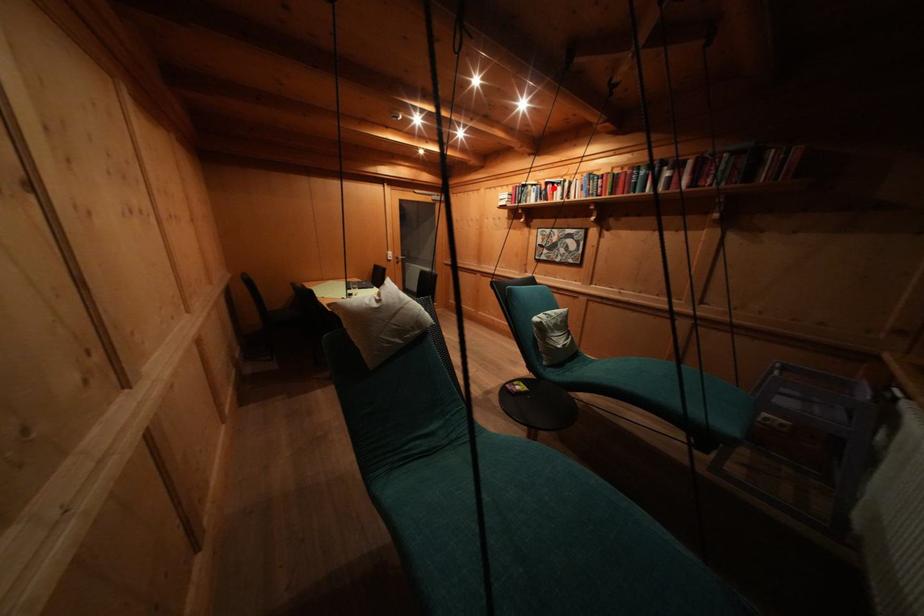
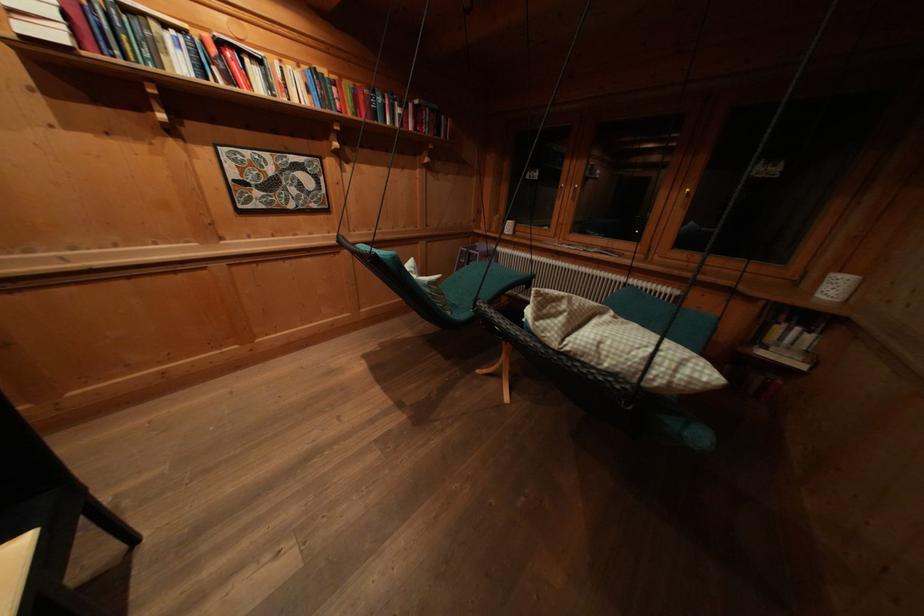
Where in the second image is the point corresponding to the highlighted location from the first image?

(225, 47)